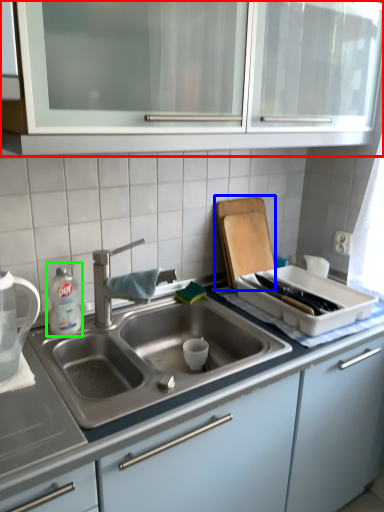
Question: Which object is the farthest from cabinetry (highlighted by a red box)? Choose among these: cutting board (highlighted by a blue box) or cleaning product (highlighted by a green box).

Choices:
 (A) cutting board
 (B) cleaning product

Answer: (B)